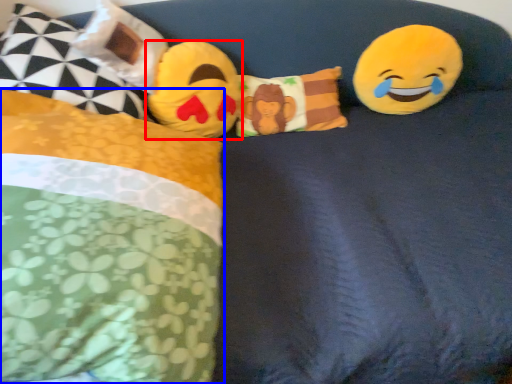
Question: Which object appears farthest to the camera in this image, toy (highlighted by a red box) or pillow (highlighted by a blue box)?

Choices:
 (A) toy
 (B) pillow

Answer: (A)